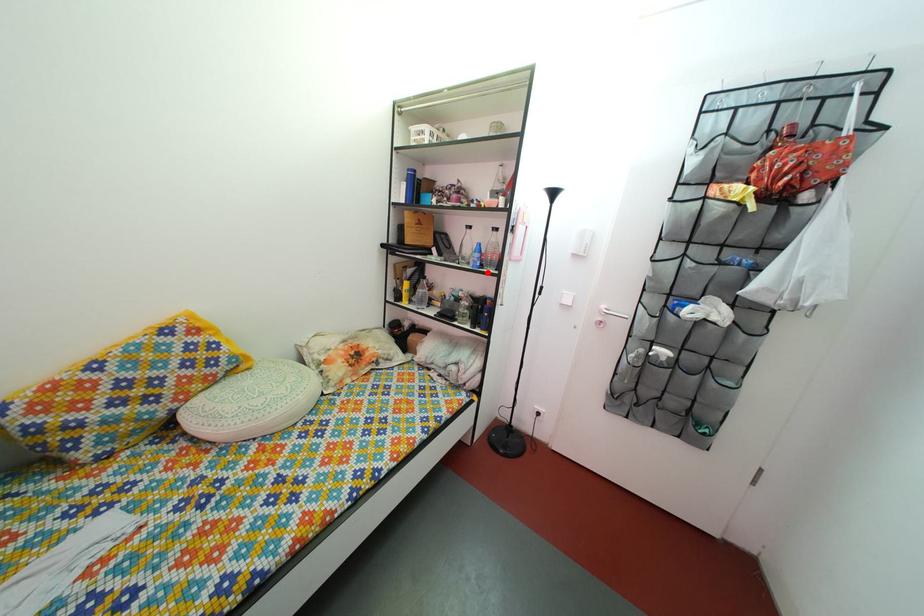
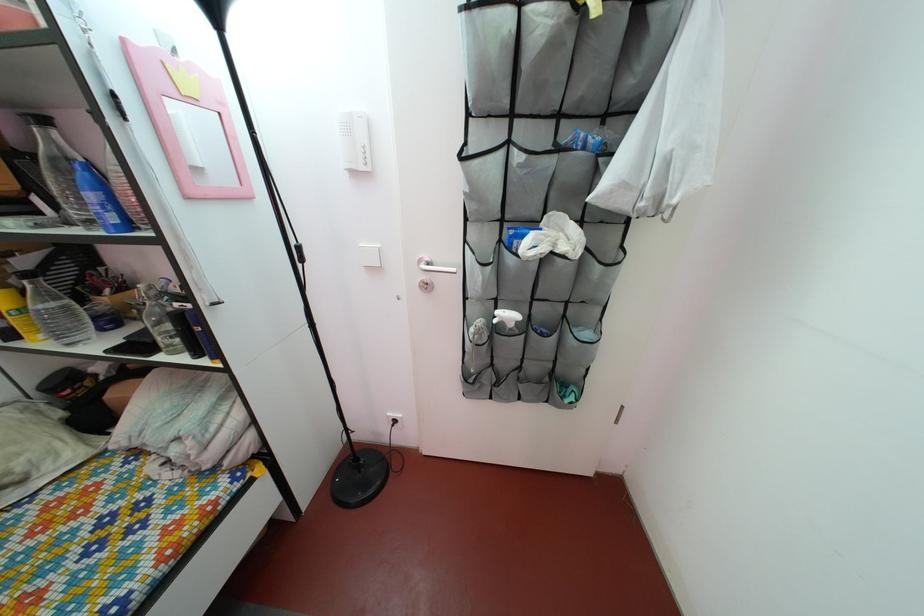
In the second image, find the point that corresponds to the highlighted location in the first image.

(124, 229)